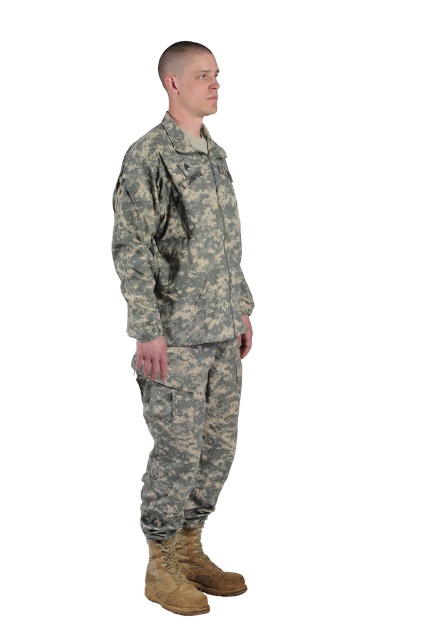
Question: Which object is the closest to the tan suede boot at lower center?

Choices:
 (A) camouflage fabric uniform at center
 (B) brown leather boot at lower center

Answer: (B)

Question: Can you confirm if camouflage fabric uniform at center is positioned above brown leather boot at lower center?

Choices:
 (A) yes
 (B) no

Answer: (A)

Question: Can you confirm if camouflage fabric uniform at center is wider than tan suede boot at lower center?

Choices:
 (A) yes
 (B) no

Answer: (A)

Question: Estimate the real-world distances between objects in this image. Which object is farther from the camouflage fabric uniform at center?

Choices:
 (A) tan suede boot at lower center
 (B) brown leather boot at lower center

Answer: (B)

Question: Does tan suede boot at lower center come behind brown leather boot at lower center?

Choices:
 (A) yes
 (B) no

Answer: (B)

Question: Which point is farther to the camera?

Choices:
 (A) tan suede boot at lower center
 (B) brown leather boot at lower center

Answer: (B)